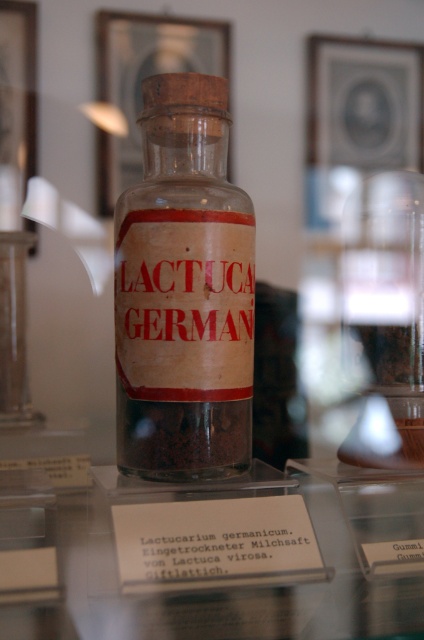
You are a museum curator planning to display the transparent glass bottle at center on a new exhibit table. The current transparent glass table at center is too small to accommodate the bottle. Can the bottle be placed on the existing table without any adjustments?

The transparent glass table at center is larger in size than the transparent glass bottle at center, so the bottle can be placed on the existing table without any adjustments.

You are a museum visitor holding a small flashlight. You want to shine the light on the transparent glass bottle at center to read its label. Since the transparent glass table at center is in the way, can you adjust your angle so the light reaches the bottle without hitting the table?

The transparent glass table at center is closer to the viewer than the transparent glass bottle at center, so you can angle the flashlight above or below the table to direct the light towards the bottle without obstruction.

You are a museum visitor standing in front of the exhibit. You see the transparent glass table at center and the white paper label at center. Which object is positioned to the right of the other?

The transparent glass table at center is to the right of the white paper label at center, so the transparent glass table at center is positioned to the right of the white paper label at center.